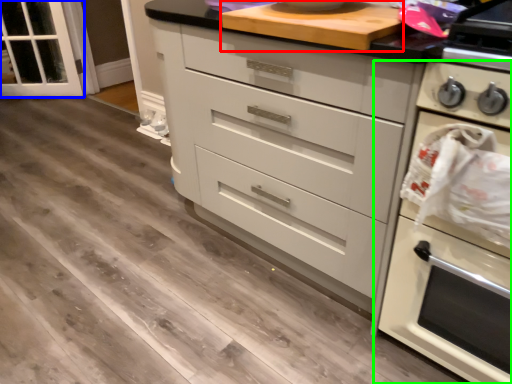
Question: Estimate the real-world distances between objects in this image. Which object is closer to appliance (highlighted by a red box), glass door (highlighted by a blue box) or home appliance (highlighted by a green box)?

Choices:
 (A) glass door
 (B) home appliance

Answer: (B)